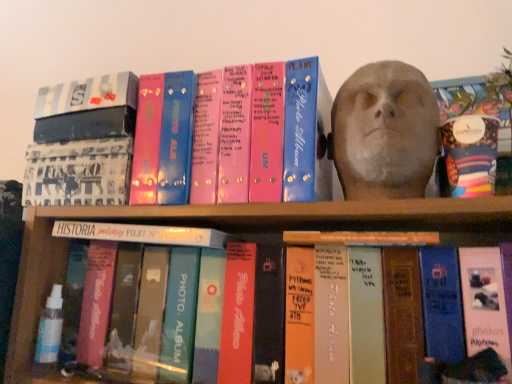
Question: Is matte gray bust at upper right wider or thinner than orange matte book at center, positioned as the 2th book in top-to-bottom order?

Choices:
 (A) thin
 (B) wide

Answer: (A)

Question: Choose the correct answer: Is matte gray bust at upper right inside orange matte book at center, positioned as the 2th book in top-to-bottom order, or outside it?

Choices:
 (A) outside
 (B) inside

Answer: (A)

Question: Which of these objects is positioned farthest from the orange matte book at center, positioned as the 2th book in top-to-bottom order?

Choices:
 (A) white textured fabric album at upper left
 (B) matte gray bust at upper right
 (C) white matte book at center, arranged as the third book when viewed from the top
 (D) multicolored fabric bag at upper right
 (E) pink glossy photo album at upper center, which appears as the first book when viewed from the top

Answer: (A)

Question: Which object is the farthest from the white textured fabric album at upper left?

Choices:
 (A) pink glossy photo album at upper center, which is counted as the third book, starting from the bottom
 (B) matte gray bust at upper right
 (C) orange matte book at center, positioned as the 2th book in top-to-bottom order
 (D) white matte book at center, the 1th book from the bottom
 (E) multicolored fabric bag at upper right

Answer: (E)